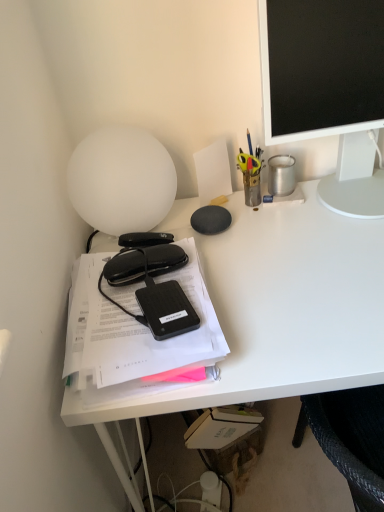
Question: Would you say black matte hardcover at left is a long distance from metallic pen holder at upper right, the second stationery from the front?

Choices:
 (A) no
 (B) yes

Answer: (A)

Question: Considering the relative sizes of black matte hardcover at left and metallic pen holder at upper right, the second stationery from the right, in the image provided, is black matte hardcover at left wider than metallic pen holder at upper right, the second stationery from the right,?

Choices:
 (A) yes
 (B) no

Answer: (A)

Question: Is black matte hardcover at left in front of metallic pen holder at upper right, which is the third stationery from back to front?

Choices:
 (A) yes
 (B) no

Answer: (A)

Question: Considering the relative sizes of black matte hardcover at left and metallic pen holder at upper right, the second stationery from the right, in the image provided, is black matte hardcover at left smaller than metallic pen holder at upper right, the second stationery from the right,?

Choices:
 (A) yes
 (B) no

Answer: (B)

Question: Considering the relative sizes of black matte hardcover at left and metallic pen holder at upper right, the 3th stationery ordered from the bottom, in the image provided, is black matte hardcover at left taller than metallic pen holder at upper right, the 3th stationery ordered from the bottom,?

Choices:
 (A) yes
 (B) no

Answer: (B)

Question: In terms of width, does white plastic bottle at lower center, the 1th stationery when ordered from back to front, look wider or thinner when compared to white matte lamp at upper left?

Choices:
 (A) thin
 (B) wide

Answer: (A)

Question: From a real-world perspective, is white plastic bottle at lower center, marked as the 2th stationery in a left-to-right arrangement, positioned above or below white matte lamp at upper left?

Choices:
 (A) above
 (B) below

Answer: (B)

Question: From the image's perspective, relative to white matte lamp at upper left, is white plastic bottle at lower center, which appears as the fourth stationery when viewed from the front, above or below?

Choices:
 (A) above
 (B) below

Answer: (B)

Question: In terms of size, does white plastic bottle at lower center, which appears as the fourth stationery when viewed from the front, appear bigger or smaller than white matte lamp at upper left?

Choices:
 (A) big
 (B) small

Answer: (B)

Question: Looking at the image, does metallic silver pen holder at upper right, placed as the 1th stationery when sorted from right to left, seem bigger or smaller compared to white plastic bottle at lower center, marked as the 2th stationery in a left-to-right arrangement?

Choices:
 (A) small
 (B) big

Answer: (B)

Question: In terms of width, does metallic silver pen holder at upper right, placed as the third stationery when sorted from front to back, look wider or thinner when compared to white plastic bottle at lower center, which appears as the fourth stationery when viewed from the front?

Choices:
 (A) thin
 (B) wide

Answer: (B)

Question: Relative to white plastic bottle at lower center, the 4th stationery in the top-to-bottom sequence, is metallic silver pen holder at upper right, which is counted as the fourth stationery, starting from the bottom, in front or behind?

Choices:
 (A) behind
 (B) front

Answer: (B)

Question: From a real-world perspective, is metallic silver pen holder at upper right, which is counted as the fourth stationery, starting from the bottom, above or below white plastic bottle at lower center, the 4th stationery in the top-to-bottom sequence?

Choices:
 (A) above
 (B) below

Answer: (A)

Question: Considering the positions of black matte hardcover at left and white plastic bottle at lower center, which appears as the fourth stationery when viewed from the front, in the image, is black matte hardcover at left taller or shorter than white plastic bottle at lower center, which appears as the fourth stationery when viewed from the front,?

Choices:
 (A) short
 (B) tall

Answer: (B)

Question: From a real-world perspective, is black matte hardcover at left positioned above or below white plastic bottle at lower center, which appears as the third stationery when viewed from the right?

Choices:
 (A) above
 (B) below

Answer: (A)